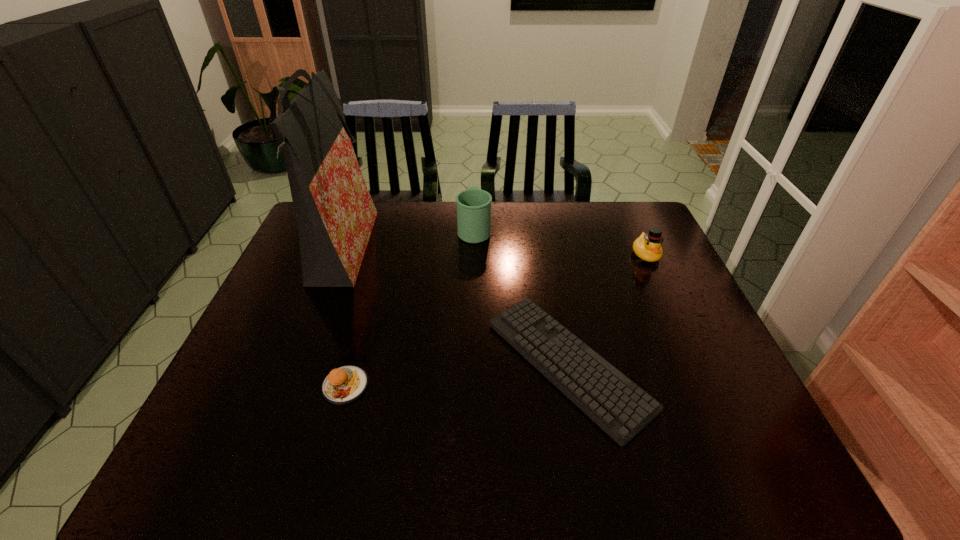
You are a GUI agent. You are given a task and a screenshot of the screen. Output one action in this format:
    pyautogui.click(x=<x>, y=<y>)
    Task: Click on the tallest object
    The width and height of the screenshot is (960, 540).
    Given the screenshot: What is the action you would take?
    pyautogui.click(x=335, y=214)

Image resolution: width=960 pixels, height=540 pixels. Identify the location of the fourth shortest object. (473, 205).

Locate an element on the screen. The width and height of the screenshot is (960, 540). the rightmost object is located at coordinates (647, 247).

Locate an element on the screen. duck is located at coordinates pyautogui.click(x=647, y=247).

Locate an element on the screen. This screenshot has height=540, width=960. patty is located at coordinates (345, 384).

Locate an element on the screen. The width and height of the screenshot is (960, 540). the shortest object is located at coordinates (621, 408).

At what (x,y) coordinates should I click in order to perform the action: click on free space located on the front side of the shopping bag. Please return your answer as a coordinate pair (x, y). The image size is (960, 540). Looking at the image, I should click on (395, 252).

At what (x,y) coordinates should I click in order to perform the action: click on free region located 0.330m on the front-facing side of the rightmost object. Please return your answer as a coordinate pair (x, y). Looking at the image, I should click on (690, 352).

The image size is (960, 540). Identify the location of free point located on the back of the patty. (358, 339).

Where is `vacant area located on the front of the computer keyboard`? The image size is (960, 540). vacant area located on the front of the computer keyboard is located at coordinates (588, 470).